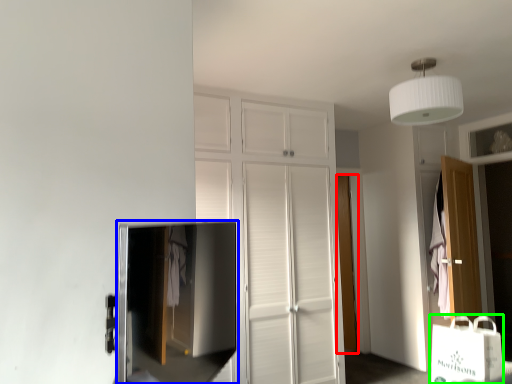
Question: Which object is positioned closest to door (highlighted by a red box)? Select from medicine cabinet (highlighted by a blue box) and shopping bag (highlighted by a green box).

Choices:
 (A) medicine cabinet
 (B) shopping bag

Answer: (A)